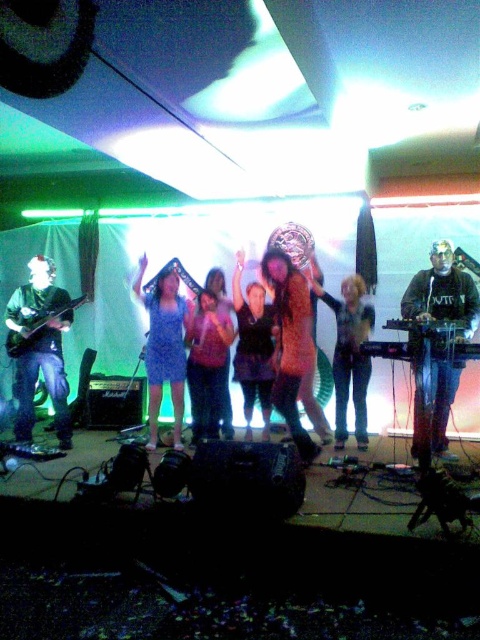
Question: Can you confirm if shiny gold dress at center is wider than matte pink dress at center?

Choices:
 (A) yes
 (B) no

Answer: (A)

Question: Which of these objects is positioned farthest from the black matte keyboard at center?

Choices:
 (A) dark purple dress at center
 (B) shiny brown dress at center
 (C) shiny gold dress at center
 (D) blue satin dress at center

Answer: (D)

Question: Which point is closer to the camera taking this photo?

Choices:
 (A) (164, 280)
 (B) (32, 266)
 (C) (352, 362)

Answer: (B)

Question: Among these objects, which one is nearest to the camera?

Choices:
 (A) matte black guitar at left
 (B) matte pink dress at center

Answer: (A)

Question: Considering the relative positions of matte pink dress at center and matte black electric guitar at left in the image provided, where is matte pink dress at center located with respect to matte black electric guitar at left?

Choices:
 (A) below
 (B) above

Answer: (A)

Question: Is the position of blue satin dress at center less distant than that of shiny gold dress at center?

Choices:
 (A) yes
 (B) no

Answer: (B)